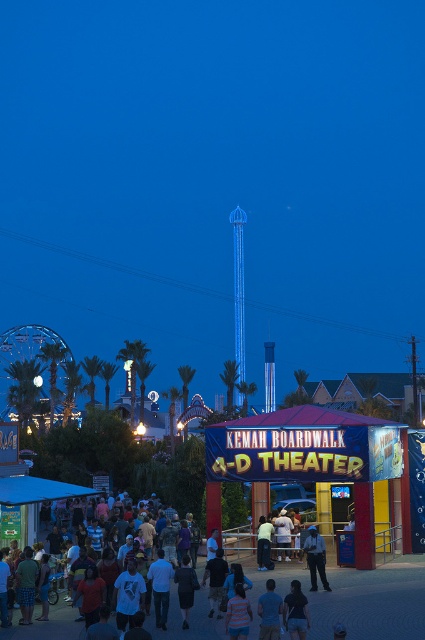
You are standing at point (187, 637) and want to reach the Ferris wheel. The distance between you and the Ferris wheel is 46.77 meters. If you walk at 1.5 m per second, how many minutes will it take you to reach the Ferris wheel?

The distance between you and the Ferris wheel is 46.77 meters. Walking at 1.5 m per second, it would take 46.77 divided by 1.5 equals approximately 31.18 seconds, which is about 0.52 minutes. So, it will take approximately 0.52 minutes to reach the Ferris wheel.

You are standing at the entrance of the Kemah Boardwalk 4D Theater. You want to find a person wearing a dark blue shirt at center. What are the coordinates of this person?

The coordinates of the dark blue shirt at center are at point (189, 620).